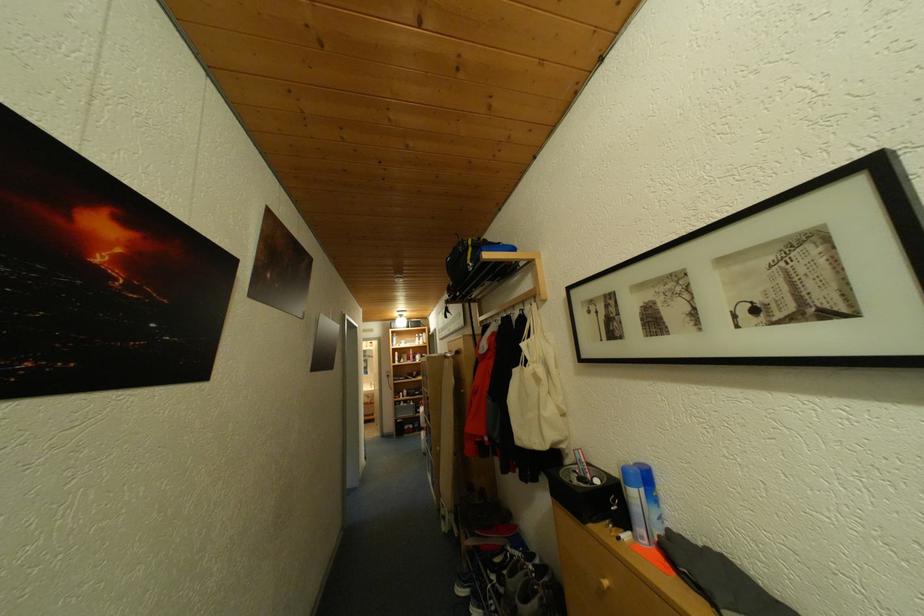
Where would you pull the round drawer knob? Please return your answer as a coordinate pair (x, y).

(602, 584)